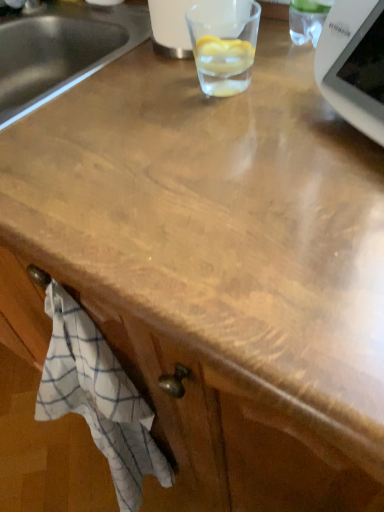
Question: Should I look upward or downward to see white checkered cloth at lower left?

Choices:
 (A) up
 (B) down

Answer: (B)